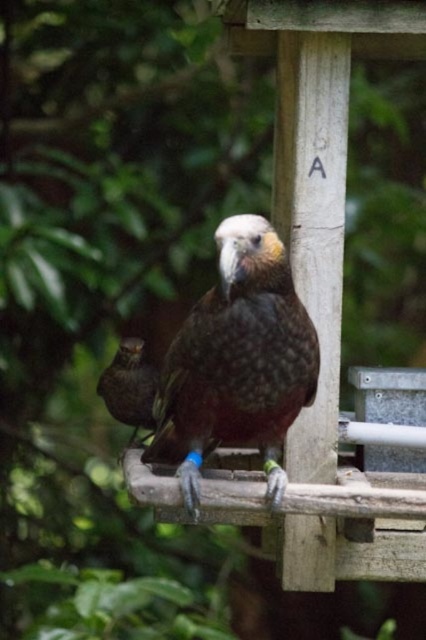
Based on the photo, can you confirm if dark brown feathers at center is positioned to the right of brown speckled feathers at center?

Yes, dark brown feathers at center is to the right of brown speckled feathers at center.

Measure the distance between point (255, 419) and camera.

Point (255, 419) is 6.22 feet away from camera.

Image resolution: width=426 pixels, height=640 pixels. I want to click on dark brown feathers at center, so click(236, 362).

What are the coordinates of `dark brown feathers at center` in the screenshot? It's located at (236, 362).